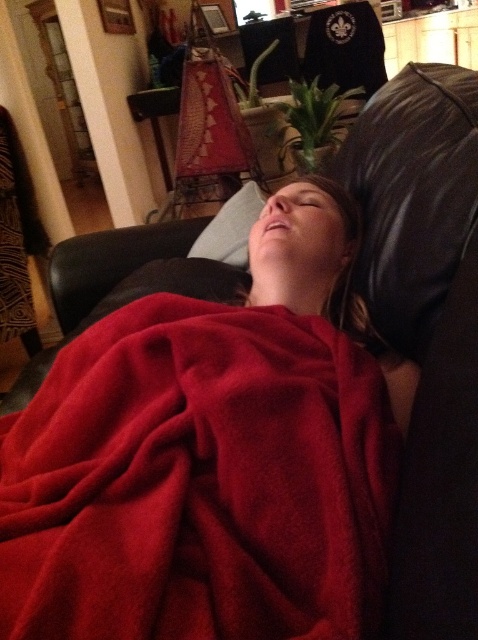
Which is more to the left, red fleece blanket at lower left or gray fabric pillow at center?

red fleece blanket at lower left is more to the left.

Does point (176, 490) come farther from viewer compared to point (236, 244)?

No, it is not.

The image size is (478, 640). Identify the location of red fleece blanket at lower left. (198, 481).

Image resolution: width=478 pixels, height=640 pixels. In order to click on red fleece blanket at lower left in this screenshot , I will do `click(198, 481)`.

Is red fleece blanket at lower left shorter than velvety red robe at lower left?

Indeed, red fleece blanket at lower left has a lesser height compared to velvety red robe at lower left.

Is red fleece blanket at lower left to the left of velvety red robe at lower left from the viewer's perspective?

No, red fleece blanket at lower left is not to the left of velvety red robe at lower left.

The width and height of the screenshot is (478, 640). What are the coordinates of `red fleece blanket at lower left` in the screenshot? It's located at (198, 481).

Between velvety red robe at lower left and gray fabric pillow at center, which one is positioned higher?

velvety red robe at lower left is higher up.

Is velvety red robe at lower left bigger than gray fabric pillow at center?

Correct, velvety red robe at lower left is larger in size than gray fabric pillow at center.

Which is behind, point (17, 237) or point (218, 259)?

The point (17, 237) is more distant.

This screenshot has width=478, height=640. In order to click on velvety red robe at lower left in this screenshot , I will do `click(14, 243)`.